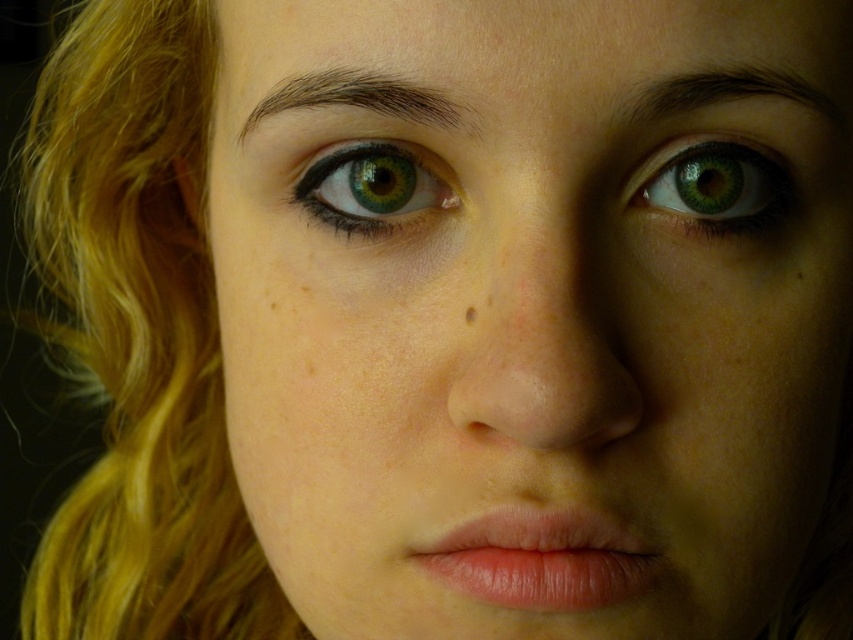
Which of these two, natural skin tone at center or brown matte freckle at center, stands taller?

With more height is natural skin tone at center.

Is point (303, 621) behind point (468, 310)?

That is True.

Does point (726, 278) lie behind point (468, 314)?

Yes, point (726, 278) is behind point (468, 314).

Identify the location of natural skin tone at center. This screenshot has width=853, height=640. (532, 305).

Between natural skin tone at center and green matte eye at center, which one has more height?

natural skin tone at center

Is point (451, 225) positioned behind point (372, 200)?

No.

Is point (656, 88) closer to camera compared to point (317, 170)?

Yes, it is.

At what (x,y) coordinates should I click in order to perform the action: click on natural skin tone at center. Please return your answer as a coordinate pair (x, y). Looking at the image, I should click on (532, 305).

Is pink glossy lips at center wider than brown matte freckle at center?

Indeed, pink glossy lips at center has a greater width compared to brown matte freckle at center.

Image resolution: width=853 pixels, height=640 pixels. What do you see at coordinates (543, 560) in the screenshot?
I see `pink glossy lips at center` at bounding box center [543, 560].

Find the location of `pink glossy lips at center`. pink glossy lips at center is located at coordinates (543, 560).